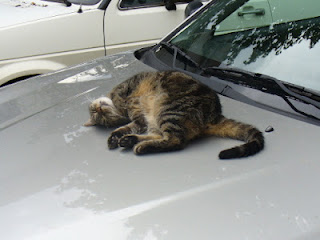
Image resolution: width=320 pixels, height=240 pixels. What are the coordinates of `door handle` in the screenshot? It's located at (252, 11).